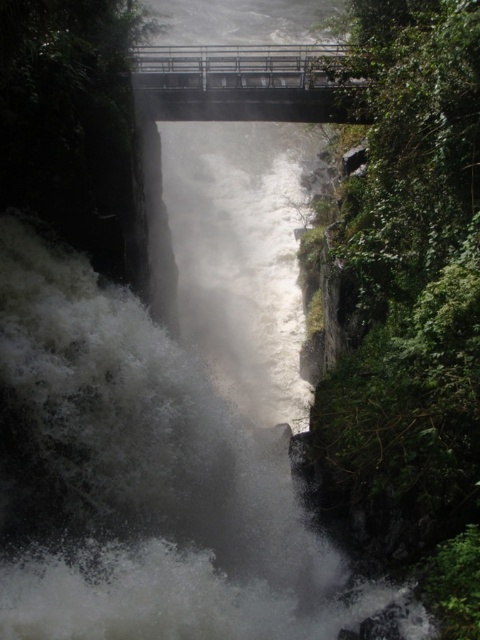
Question: Can you confirm if white frothy water at center is wider than metallic bridge at upper center?

Choices:
 (A) yes
 (B) no

Answer: (B)

Question: Which point is closer to the camera?

Choices:
 (A) white frothy water at center
 (B) metallic bridge at upper center

Answer: (A)

Question: Among these objects, which one is nearest to the camera?

Choices:
 (A) white frothy water at center
 (B) metallic bridge at upper center

Answer: (A)

Question: Is white frothy water at center further to camera compared to metallic bridge at upper center?

Choices:
 (A) no
 (B) yes

Answer: (A)

Question: Which object is closer to the camera taking this photo?

Choices:
 (A) white frothy water at center
 (B) metallic bridge at upper center

Answer: (A)

Question: Is white frothy water at center behind metallic bridge at upper center?

Choices:
 (A) no
 (B) yes

Answer: (A)